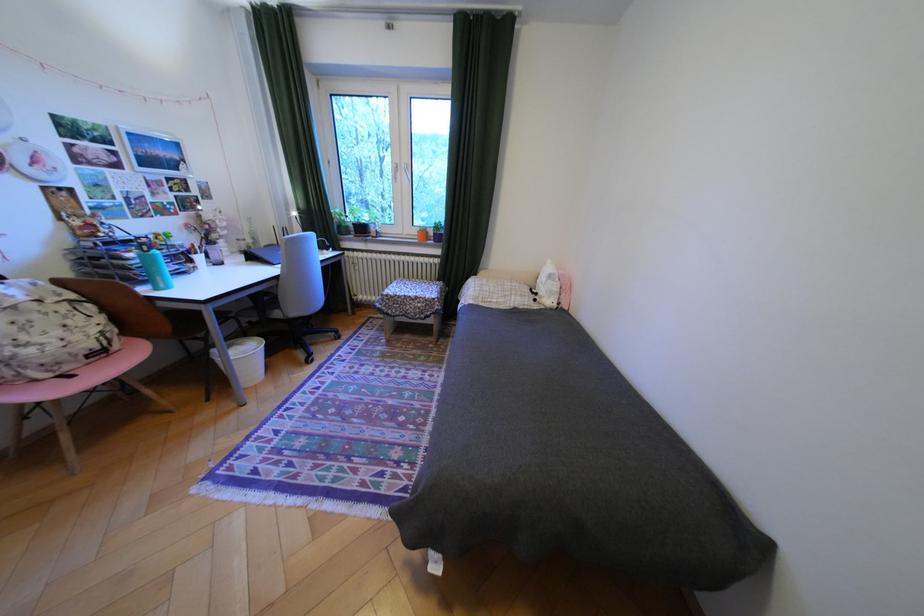
This screenshot has height=616, width=924. Describe the element at coordinates (400, 172) in the screenshot. I see `the white window handle` at that location.